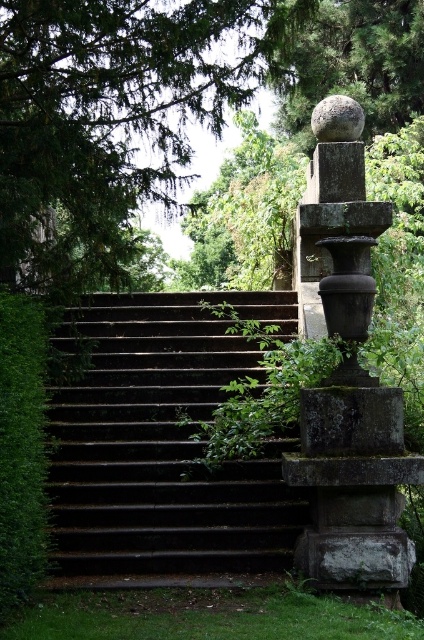
Question: Which object appears closest to the camera in this image?

Choices:
 (A) smooth gray stone at upper center
 (B) dark stone stairs at center
 (C) green leafy tree at upper left
 (D) green textured sphere at upper center

Answer: (C)

Question: Which point is closer to the camera?

Choices:
 (A) green leafy hedge at left
 (B) dark stone stairs at center
 (C) green leafy tree at upper left

Answer: (A)

Question: From the image, what is the correct spatial relationship of dark stone stairs at center in relation to smooth gray stone column at right?

Choices:
 (A) right
 (B) left

Answer: (B)

Question: Can you confirm if green leafy tree at upper left is positioned below green leafy hedge at left?

Choices:
 (A) yes
 (B) no

Answer: (B)

Question: Does green leafy tree at upper left appear on the right side of green leafy hedge at left?

Choices:
 (A) no
 (B) yes

Answer: (B)

Question: Based on their relative distances, which object is nearer to the green leafy hedge at left?

Choices:
 (A) smooth gray stone at upper center
 (B) dark stone stairs at center
 (C) smooth gray stone column at right

Answer: (B)